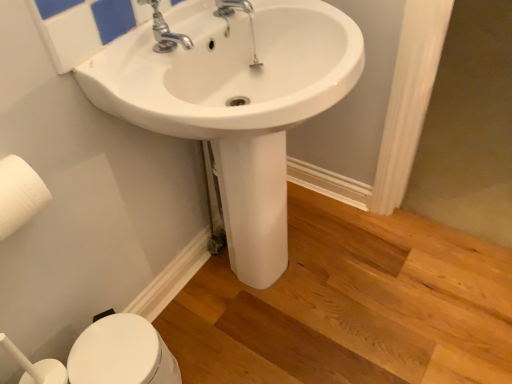
Question: Considering the relative sizes of white glossy sink at center and white glossy bidet at lower left in the image provided, is white glossy sink at center shorter than white glossy bidet at lower left?

Choices:
 (A) no
 (B) yes

Answer: (A)

Question: Can you confirm if white glossy sink at center is taller than white glossy bidet at lower left?

Choices:
 (A) yes
 (B) no

Answer: (A)

Question: From the image's perspective, is white glossy sink at center under white glossy bidet at lower left?

Choices:
 (A) yes
 (B) no

Answer: (B)

Question: From a real-world perspective, is white glossy sink at center on top of white glossy bidet at lower left?

Choices:
 (A) yes
 (B) no

Answer: (A)

Question: From the image's perspective, is white glossy sink at center located above white glossy bidet at lower left?

Choices:
 (A) no
 (B) yes

Answer: (B)

Question: Could you tell me if white glossy sink at center is turned towards white glossy bidet at lower left?

Choices:
 (A) yes
 (B) no

Answer: (B)

Question: From the image's perspective, would you say white matte toilet paper at left is positioned over white glossy sink at center?

Choices:
 (A) yes
 (B) no

Answer: (B)

Question: Does white matte toilet paper at left turn towards white glossy sink at center?

Choices:
 (A) no
 (B) yes

Answer: (A)

Question: Does white matte toilet paper at left have a lesser height compared to white glossy sink at center?

Choices:
 (A) yes
 (B) no

Answer: (A)

Question: Would you say white glossy sink at center is part of white matte toilet paper at left's contents?

Choices:
 (A) yes
 (B) no

Answer: (B)

Question: Is white matte toilet paper at left not within white glossy sink at center?

Choices:
 (A) yes
 (B) no

Answer: (A)

Question: From the image's perspective, does white matte toilet paper at left appear lower than white glossy sink at center?

Choices:
 (A) yes
 (B) no

Answer: (A)

Question: Is white glossy sink at center thinner than white matte toilet paper at left?

Choices:
 (A) yes
 (B) no

Answer: (B)